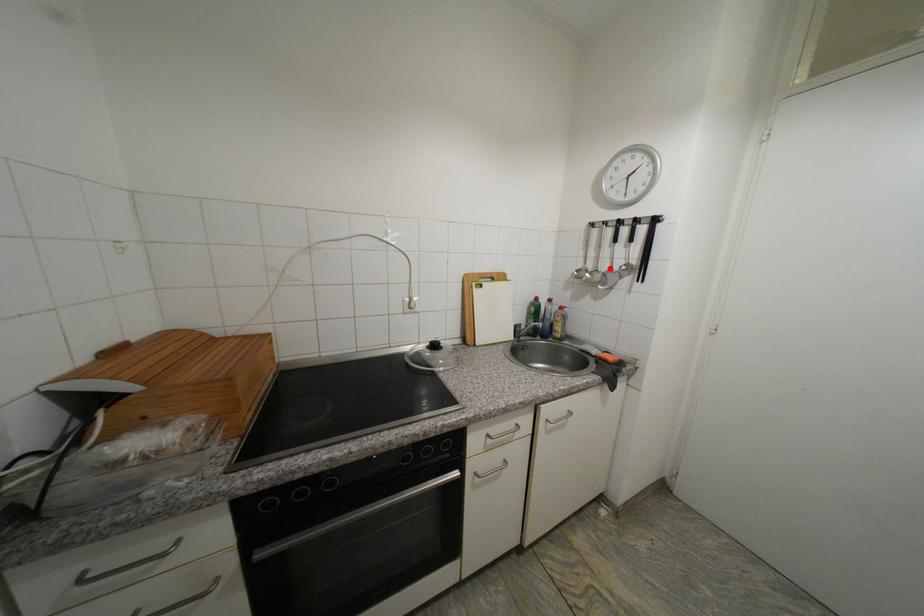
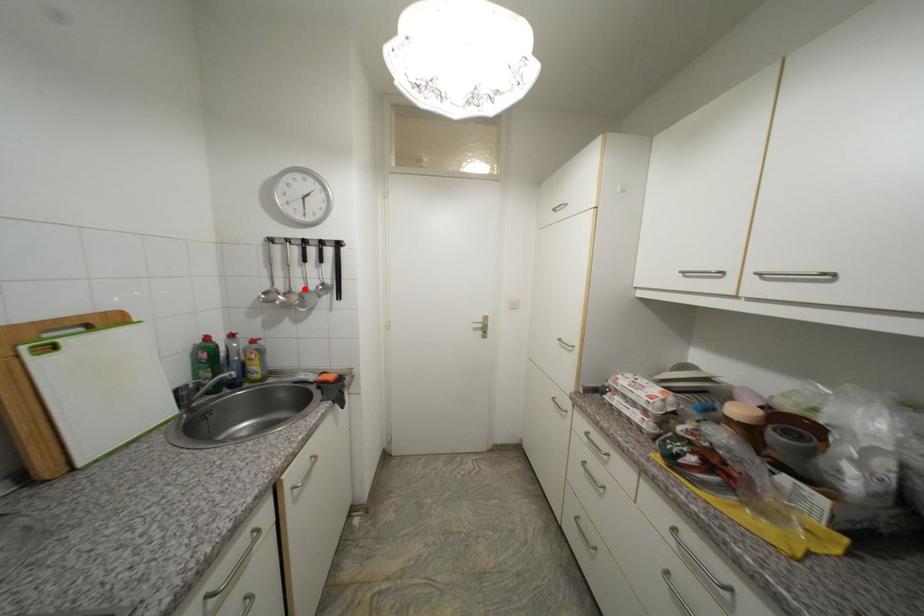
I am providing you with two images of the same scene from different viewpoints. A red point is marked on the first image and another point is marked on the second image. Does the point marked in image1 correspond to the same location as the one in image2?

Yes